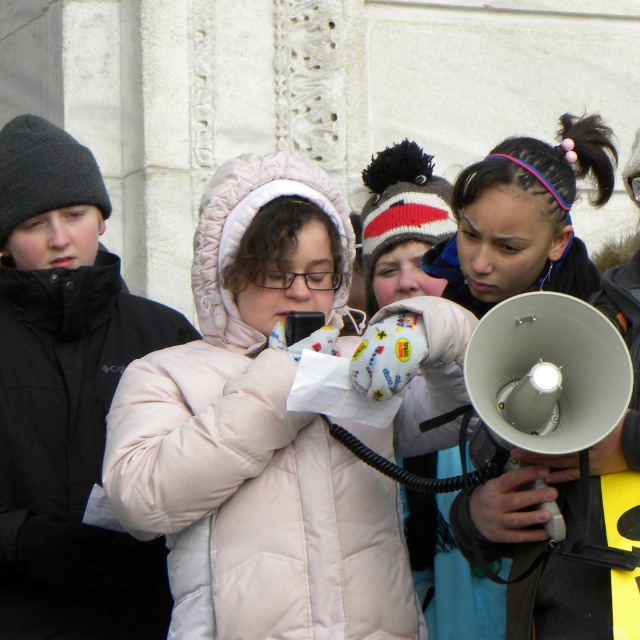
Question: Does white puffy coat at center come in front of matte gray megaphone at center?

Choices:
 (A) yes
 (B) no

Answer: (B)

Question: Is white puffy coat at center smaller than matte gray megaphone at center?

Choices:
 (A) yes
 (B) no

Answer: (A)

Question: Does white puffy coat at center appear over matte gray megaphone at center?

Choices:
 (A) no
 (B) yes

Answer: (A)

Question: Which point is farther from the camera taking this photo?

Choices:
 (A) (300, 164)
 (B) (460, 198)

Answer: (B)

Question: Which point is farther from the camera taking this photo?

Choices:
 (A) (134, 500)
 (B) (576, 268)

Answer: (B)